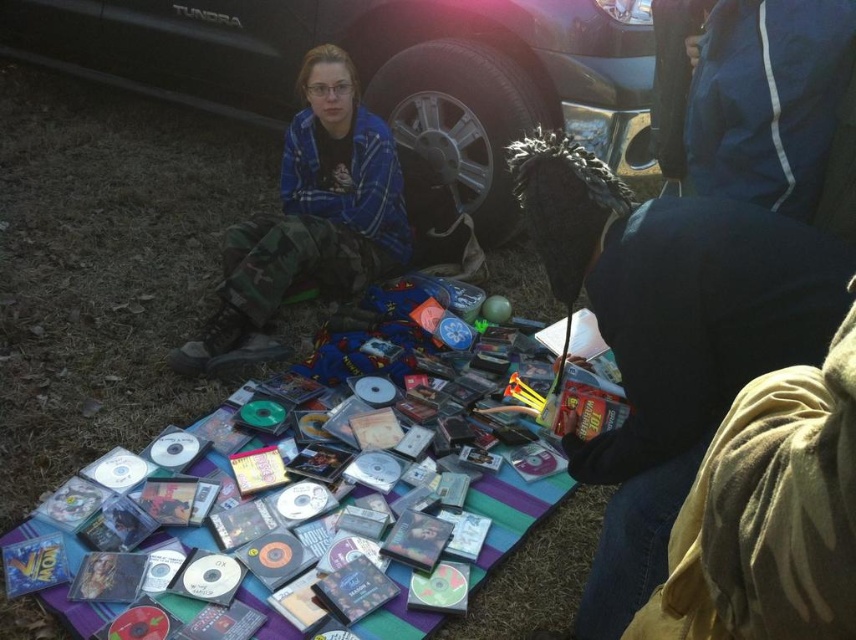
Question: Can you confirm if blue plaid shirt at center is positioned below clear plastic cds at center?

Choices:
 (A) yes
 (B) no

Answer: (B)

Question: Can you confirm if dark blue fabric at lower right is bigger than blue fabric jacket at upper right?

Choices:
 (A) yes
 (B) no

Answer: (A)

Question: Considering the relative positions of black metallic truck at upper center and blue fabric jacket at upper right in the image provided, where is black metallic truck at upper center located with respect to blue fabric jacket at upper right?

Choices:
 (A) left
 (B) right

Answer: (A)

Question: Which point is farther to the camera?

Choices:
 (A) dark blue fabric at lower right
 (B) black metallic truck at upper center
 (C) clear plastic cds at center

Answer: (B)

Question: Which point appears closest to the camera in this image?

Choices:
 (A) (159, 422)
 (B) (343, 241)
 (C) (783, 113)

Answer: (C)

Question: Which point appears closest to the camera in this image?

Choices:
 (A) (57, 28)
 (B) (687, 244)
 (C) (817, 20)

Answer: (B)